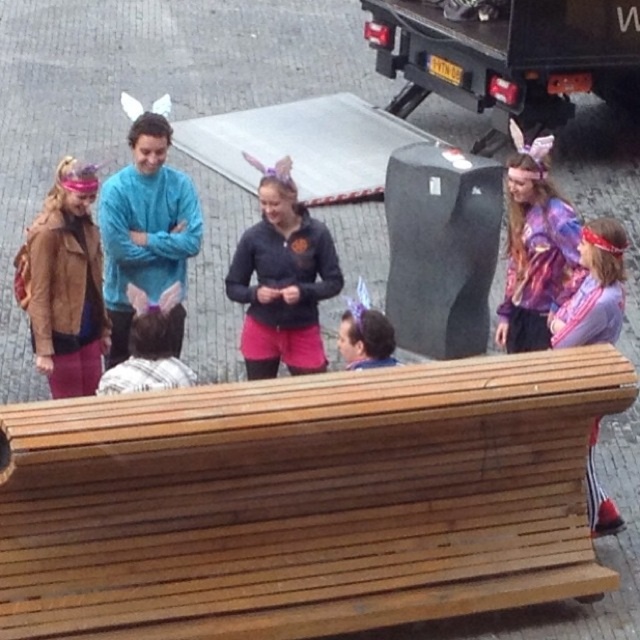
Between wooden bench at lower center and plaid fabric at center, which one is positioned lower?

wooden bench at lower center is lower down.

Which is in front, point (422, 541) or point (172, 333)?

Point (422, 541) is in front.

Find the location of a particular element. Image resolution: width=640 pixels, height=640 pixels. wooden bench at lower center is located at coordinates tap(305, 500).

From the picture: Which of these two, brown leather jacket at left or purple shiny jacket at right, stands shorter?

With less height is purple shiny jacket at right.

Which is above, brown leather jacket at left or purple shiny jacket at right?

brown leather jacket at left

The width and height of the screenshot is (640, 640). I want to click on brown leather jacket at left, so click(65, 284).

Measure the distance from wooden bench at lower center to matte blue sweater at center.

2.71 meters

Between wooden bench at lower center and matte blue sweater at center, which one is positioned lower?

Positioned lower is wooden bench at lower center.

The height and width of the screenshot is (640, 640). Identify the location of wooden bench at lower center. (305, 500).